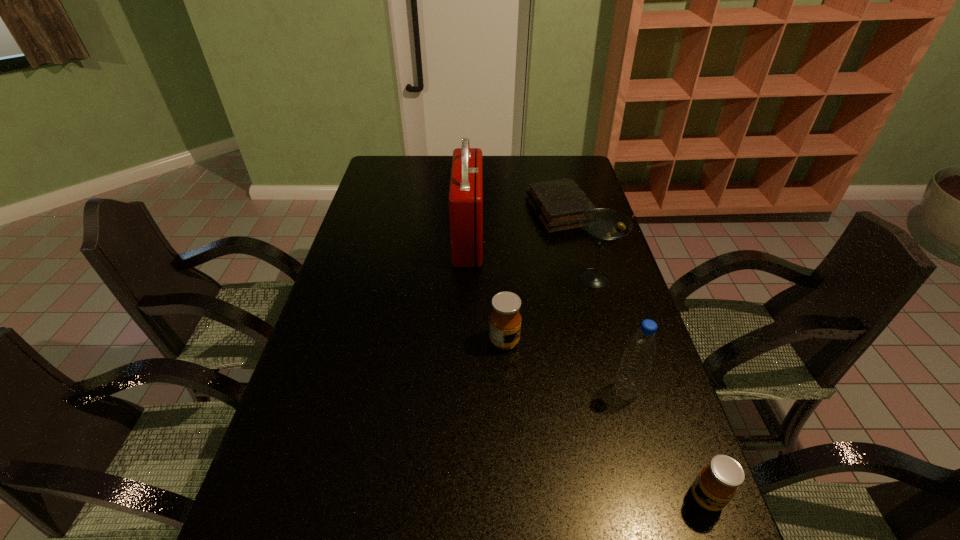
This screenshot has height=540, width=960. In order to click on vacant region located on the front of the shortest object in this screenshot , I will do `click(575, 273)`.

This screenshot has width=960, height=540. I want to click on vacant space located on the front face of the first-aid kit, so click(x=558, y=239).

This screenshot has height=540, width=960. I want to click on vacant region located 0.400m on the back of the fifth farthest object, so click(x=591, y=273).

Where is `free point located on the front of the martini`? This screenshot has height=540, width=960. free point located on the front of the martini is located at coordinates pos(624,383).

Find the location of a particular element. object situated at the near edge is located at coordinates (716, 484).

The image size is (960, 540). I want to click on honey that is at the right edge, so click(x=716, y=484).

Where is `book located at the right edge`? The width and height of the screenshot is (960, 540). book located at the right edge is located at coordinates (558, 204).

Locate an element on the screen. The height and width of the screenshot is (540, 960). water bottle positioned at the right edge is located at coordinates (641, 347).

I want to click on martini at the right edge, so click(604, 226).

Identify the location of object situated at the near right corner. This screenshot has width=960, height=540. (716, 484).